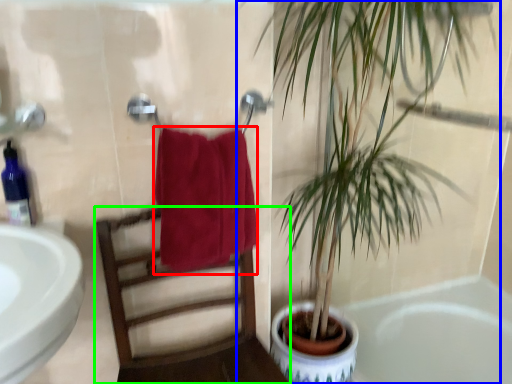
Question: Which object is positioned farthest from towel/napkin (highlighted by a red box)? Select from houseplant (highlighted by a blue box) and chair (highlighted by a green box).

Choices:
 (A) houseplant
 (B) chair

Answer: (A)